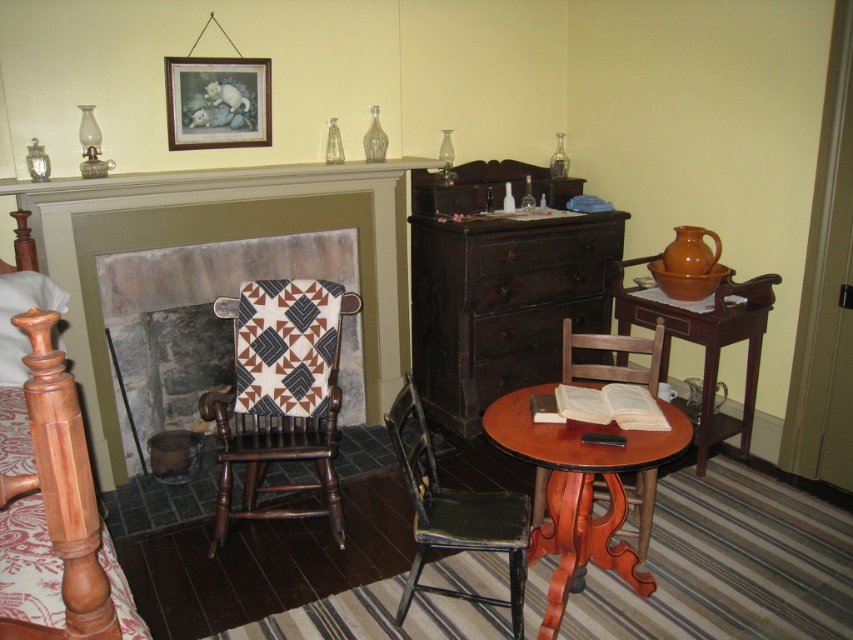
You are standing in the vintage room and need to place a small decorative item between the two points, point (x=338, y=544) and point (x=592, y=240). Which point should the item be closer to in order to be centered between them?

To center the item between point (x=338, y=544) and point (x=592, y=240), it should be placed equidistant from both points. Since point (x=338, y=544) is in front of point (x=592, y=240), the centered position would be closer to point (x=338, y=544) because it is ahead in the spatial arrangement.

You are a guest in this room and need to sit down. There is a quilted fabric rocking chair at center and a distressed green wood chair at lower center. How far apart are these two chairs?

The quilted fabric rocking chair at center is 24.61 inches from the distressed green wood chair at lower center.

You are standing in the room and want to reach both points mentioned. Which point is closer to you, point (202,404) or point (468,531)?

Point (202,404) is closer to you than point (468,531) because it is further to the viewer.